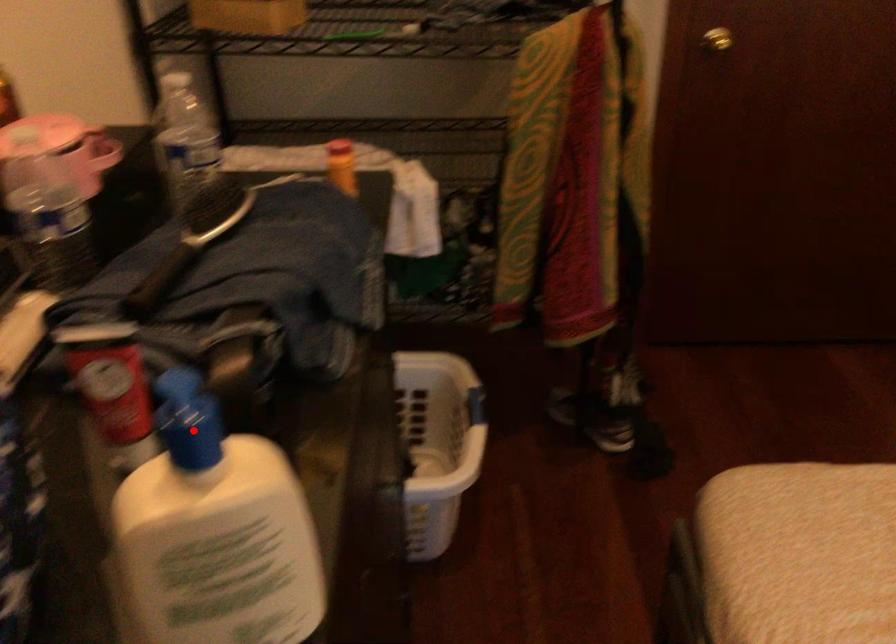
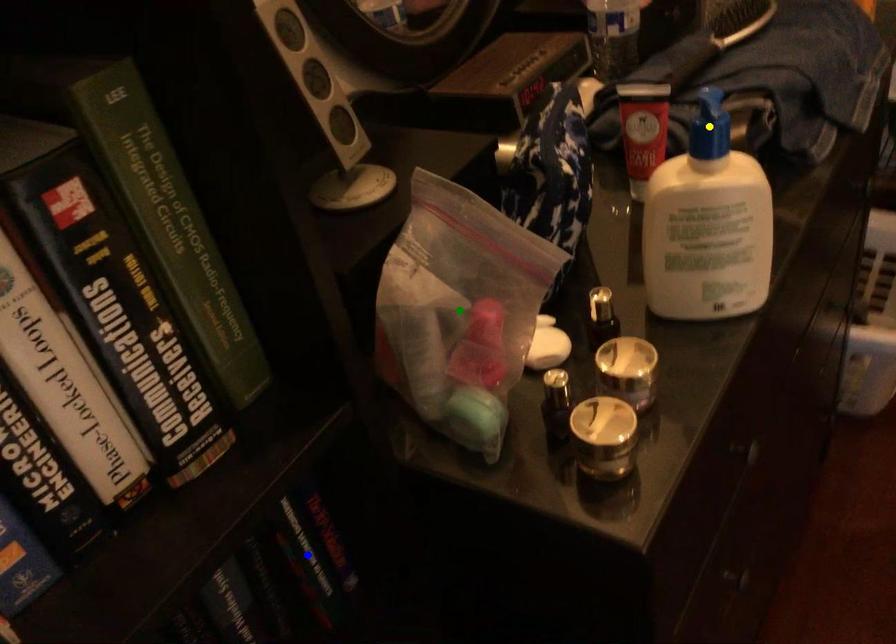
Question: I am providing you with two images of the same scene from different viewpoints. A red point is marked on the first image. You are given multiple points on the second image. Which point in image 2 represents the same 3d spot as the red point in image 1?

Choices:
 (A) blue point
 (B) yellow point
 (C) green point

Answer: (B)